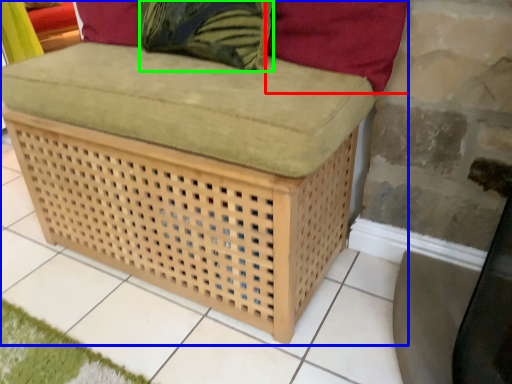
Question: Which object is the closest to the pillow (highlighted by a red box)? Choose among these: furniture (highlighted by a blue box) or throw pillow (highlighted by a green box).

Choices:
 (A) furniture
 (B) throw pillow

Answer: (B)